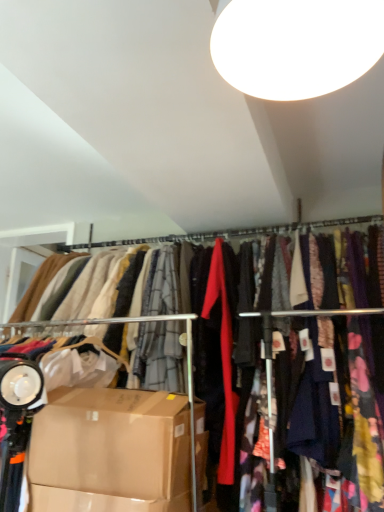
In order to face brown cardboard box at lower left, should I rotate leftwards or rightwards?

Turn left by 11.646 degrees to look at brown cardboard box at lower left.

Identify the location of silky fabric clothesline at center. (226, 233).

Considering the sizes of objects white glossy light fixture at upper center and brown cardboard box at lower left in the image provided, who is bigger, white glossy light fixture at upper center or brown cardboard box at lower left?

With larger size is brown cardboard box at lower left.

This screenshot has width=384, height=512. What are the coordinates of `box below the white glossy light fixture at upper center (from the image's perspective)` in the screenshot? It's located at (111, 452).

Considering the points (268, 22) and (82, 418), which point is behind, point (268, 22) or point (82, 418)?

The point (82, 418) is more distant.

Considering the positions of objects white glossy light fixture at upper center and brown cardboard box at lower left in the image provided, who is more to the left, white glossy light fixture at upper center or brown cardboard box at lower left?

Positioned to the left is brown cardboard box at lower left.

From their relative heights in the image, would you say silky fabric clothesline at center is taller or shorter than brown cardboard box at lower left?

In the image, silky fabric clothesline at center appears to be shorter than brown cardboard box at lower left.

Who is smaller, silky fabric clothesline at center or brown cardboard box at lower left?

With smaller size is silky fabric clothesline at center.

Between silky fabric clothesline at center and brown cardboard box at lower left, which one has larger width?

brown cardboard box at lower left.

From the image's perspective, is brown cardboard box at lower left located above or below silky fabric clothesline at center?

brown cardboard box at lower left is below silky fabric clothesline at center.

Is silky fabric clothesline at center inside brown cardboard box at lower left?

No, silky fabric clothesline at center is located outside of brown cardboard box at lower left.

How many degrees apart are the facing directions of brown cardboard box at lower left and silky fabric clothesline at center?

The facing directions of brown cardboard box at lower left and silky fabric clothesline at center are 0.502 degrees apart.

In the scene shown: Can you confirm if brown cardboard box at lower left is positioned to the right of silky fabric clothesline at center?

No, brown cardboard box at lower left is not to the right of silky fabric clothesline at center.

Is white glossy light fixture at upper center located outside silky fabric clothesline at center?

Absolutely, white glossy light fixture at upper center is external to silky fabric clothesline at center.

Is white glossy light fixture at upper center bigger or smaller than silky fabric clothesline at center?

Considering their sizes, white glossy light fixture at upper center takes up more space than silky fabric clothesline at center.

Based on the photo, does white glossy light fixture at upper center turn towards silky fabric clothesline at center?

No, white glossy light fixture at upper center is not turned towards silky fabric clothesline at center.

In the scene shown: From a real-world perspective, is white glossy light fixture at upper center physically below silky fabric clothesline at center?

Indeed, from a real-world perspective, white glossy light fixture at upper center is positioned beneath silky fabric clothesline at center.

Does brown cardboard box at lower left appear on the right side of white glossy light fixture at upper center?

No, brown cardboard box at lower left is not to the right of white glossy light fixture at upper center.

Can you confirm if brown cardboard box at lower left is smaller than white glossy light fixture at upper center?

No, brown cardboard box at lower left is not smaller than white glossy light fixture at upper center.

Which object is thinner, brown cardboard box at lower left or white glossy light fixture at upper center?

brown cardboard box at lower left.

Which of these two, silky fabric clothesline at center or white glossy light fixture at upper center, stands shorter?

Standing shorter between the two is silky fabric clothesline at center.

Is silky fabric clothesline at center situated inside white glossy light fixture at upper center or outside?

silky fabric clothesline at center cannot be found inside white glossy light fixture at upper center.

From the image's perspective, which object appears higher, silky fabric clothesline at center or white glossy light fixture at upper center?

white glossy light fixture at upper center appears higher in the image.

From a real-world perspective, who is located lower, silky fabric clothesline at center or white glossy light fixture at upper center?

In real-world perspective, white glossy light fixture at upper center is lower.

You are a GUI agent. You are given a task and a screenshot of the screen. Output one action in this format:
    pyautogui.click(x=<x>, y=<y>)
    Task: Click on the lamp located above the brown cardboard box at lower left (from a real-world perspective)
    This screenshot has width=384, height=512.
    Given the screenshot: What is the action you would take?
    pyautogui.click(x=296, y=45)

This screenshot has width=384, height=512. I want to click on clothesline behind the brown cardboard box at lower left, so click(x=226, y=233).

From the image, which object appears to be farther from silky fabric clothesline at center, white glossy light fixture at upper center or brown cardboard box at lower left?

white glossy light fixture at upper center.

Looking at the image, which one is located further to white glossy light fixture at upper center, brown cardboard box at lower left or silky fabric clothesline at center?

silky fabric clothesline at center lies further to white glossy light fixture at upper center than the other object.

When comparing their distances from brown cardboard box at lower left, does white glossy light fixture at upper center or silky fabric clothesline at center seem further?

Based on the image, white glossy light fixture at upper center appears to be further to brown cardboard box at lower left.

Looking at the image, which one is located further to brown cardboard box at lower left, silky fabric clothesline at center or white glossy light fixture at upper center?

Based on the image, white glossy light fixture at upper center appears to be further to brown cardboard box at lower left.

Looking at the image, which one is located further to silky fabric clothesline at center, brown cardboard box at lower left or white glossy light fixture at upper center?

white glossy light fixture at upper center.

Looking at the image, which one is located closer to white glossy light fixture at upper center, silky fabric clothesline at center or brown cardboard box at lower left?

brown cardboard box at lower left lies closer to white glossy light fixture at upper center than the other object.

This screenshot has width=384, height=512. I want to click on box located between white glossy light fixture at upper center and silky fabric clothesline at center in the depth direction, so click(111, 452).